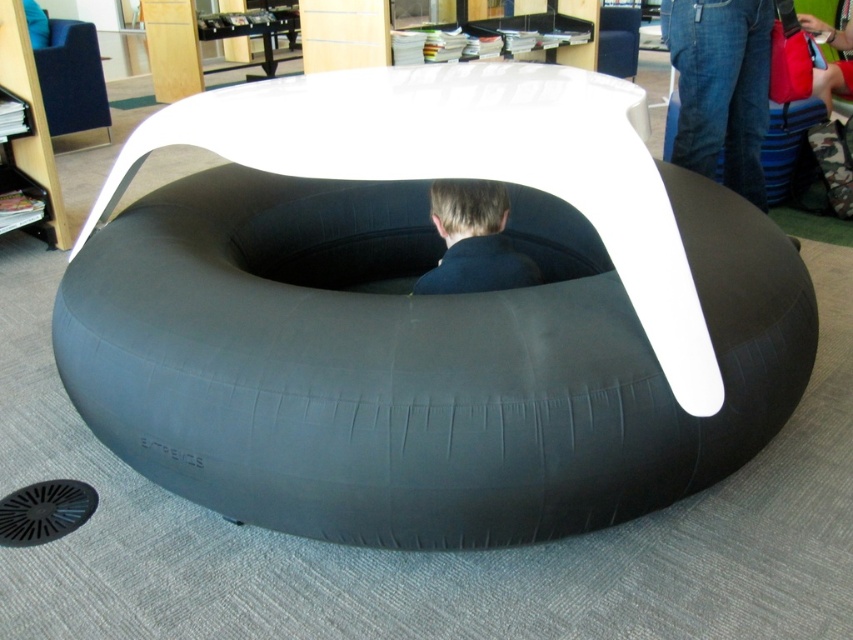
Question: Is jeans at center wider than dark blue fabric at center?

Choices:
 (A) no
 (B) yes

Answer: (B)

Question: Estimate the real-world distances between objects in this image. Which object is closer to the jeans at center?

Choices:
 (A) dark blue fabric at center
 (B) matte black bean bag chair at upper left

Answer: (A)

Question: Which object is farther from the camera taking this photo?

Choices:
 (A) jeans at center
 (B) dark blue fabric at center
 (C) matte black bean bag chair at upper left

Answer: (C)

Question: Can you confirm if jeans at center is positioned above dark blue fabric at center?

Choices:
 (A) no
 (B) yes

Answer: (B)

Question: Can you confirm if dark blue fabric at center is positioned to the left of matte black bean bag chair at upper left?

Choices:
 (A) yes
 (B) no

Answer: (B)

Question: Estimate the real-world distances between objects in this image. Which object is farther from the dark blue fabric at center?

Choices:
 (A) jeans at center
 (B) matte black bean bag chair at upper left

Answer: (B)